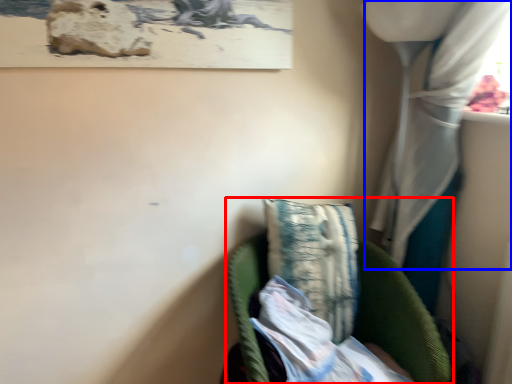
Question: Which object appears farthest to the camera in this image, furniture (highlighted by a red box) or curtain (highlighted by a blue box)?

Choices:
 (A) furniture
 (B) curtain

Answer: (A)